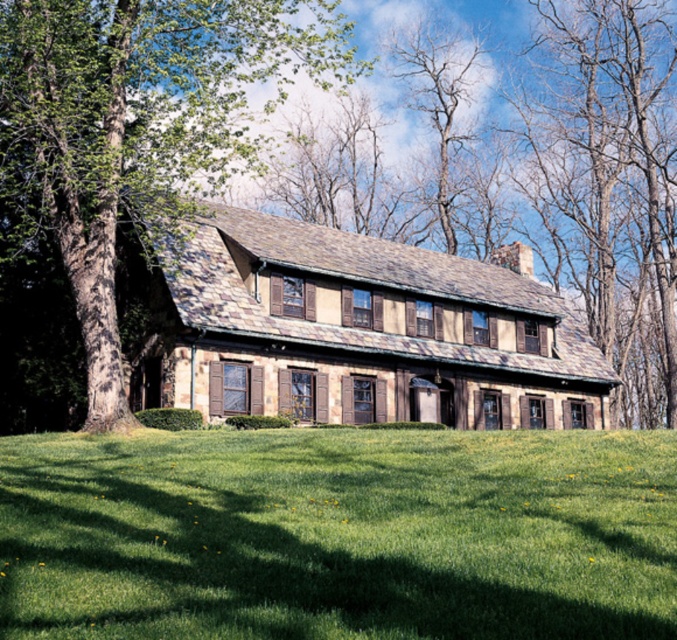
You are standing in front of the house and want to walk towards the green leafy tree at left. Which direction should you move relative to the green grass at lower center?

You should move towards the left side of the green grass at lower center since the green leafy tree at left is positioned to the left of the green grass at lower center.

You are standing in front of the house and notice the green grass at lower center and the green leafy tree at left. From your perspective, which object is positioned to the right of the other?

The green grass at lower center is to the right of the green leafy tree at left.